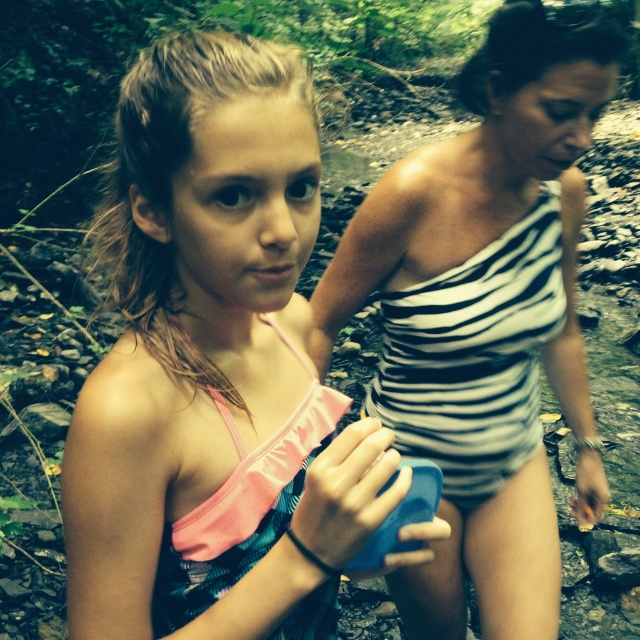
Is pink fabric swimsuit at center thinner than striped fabric swimsuit at center?

Indeed, pink fabric swimsuit at center has a lesser width compared to striped fabric swimsuit at center.

Between pink fabric swimsuit at center and striped fabric swimsuit at center, which one has more height?

Standing taller between the two is striped fabric swimsuit at center.

The height and width of the screenshot is (640, 640). In order to click on pink fabric swimsuit at center in this screenshot , I will do `click(214, 369)`.

Identify the location of pink fabric swimsuit at center. This screenshot has width=640, height=640. coord(214,369).